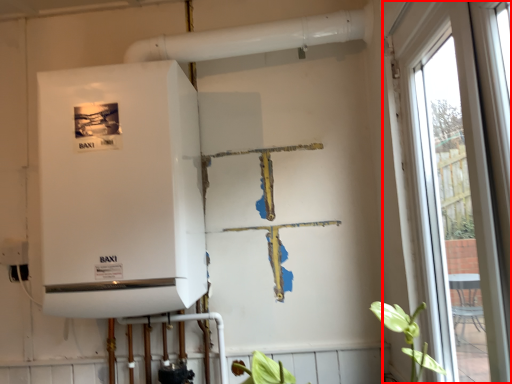
Question: From the image, what is the correct spatial relationship of window (annotated by the red box) in relation to appliance?

Choices:
 (A) right
 (B) left

Answer: (A)